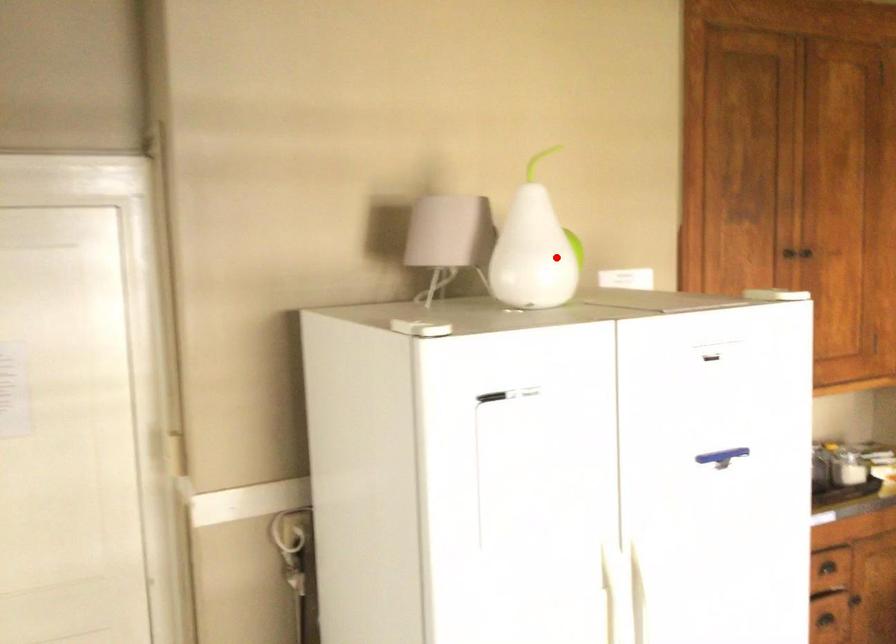
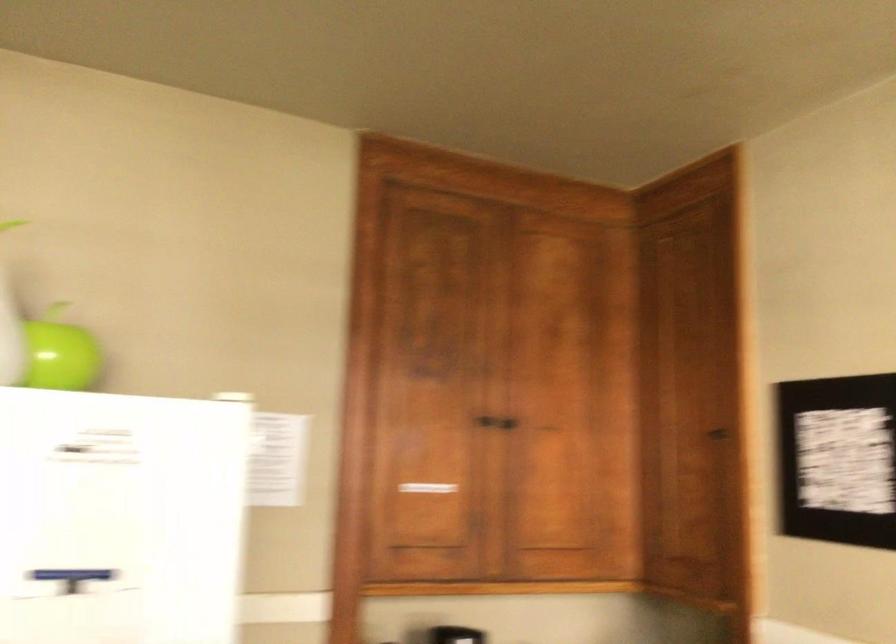
In the second image, find the point that corresponds to the highlighted location in the first image.

(59, 353)